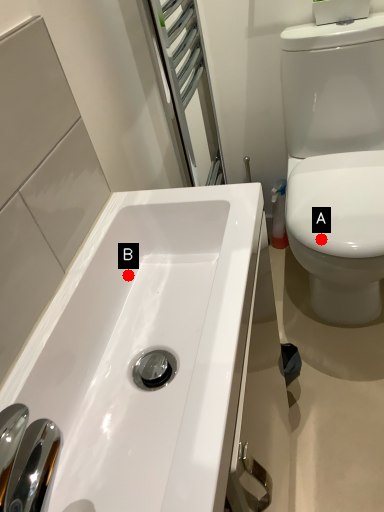
Question: Two points are circled on the image, labeled by A and B beside each circle. Which of the following is the farthest from the observer?

Choices:
 (A) A is further
 (B) B is further

Answer: (A)